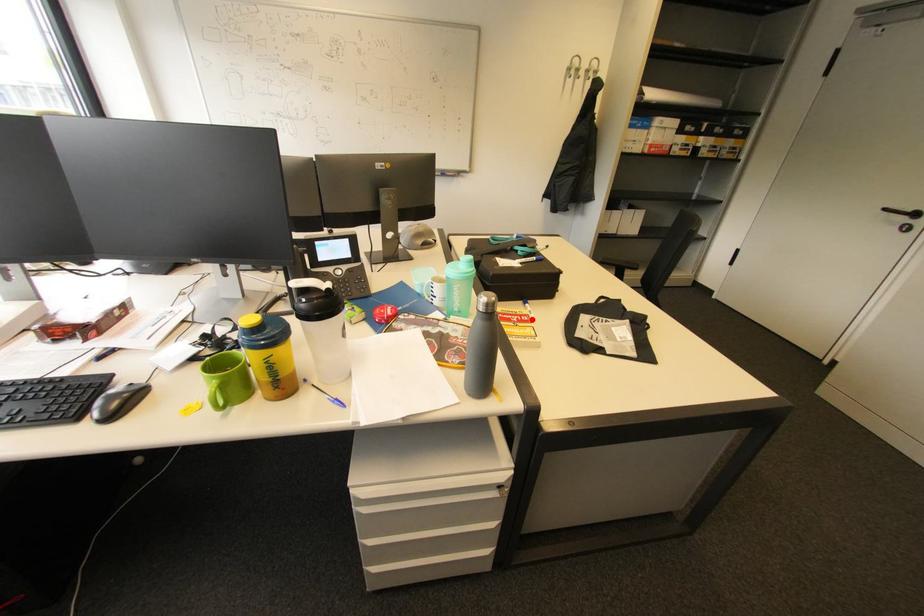
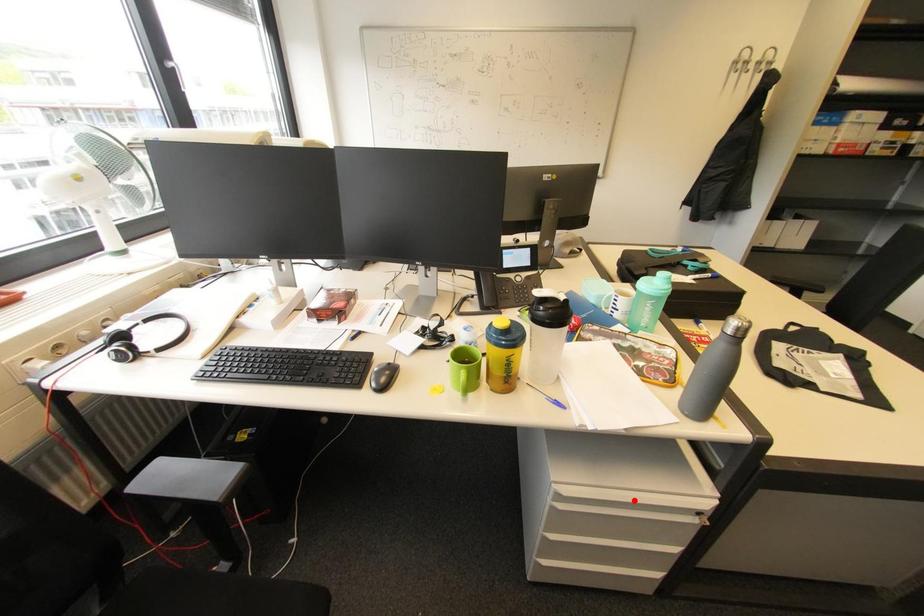
I am providing you with two images of the same scene from different viewpoints. A red point is marked on the first image and another point is marked on the second image. Is the marked point in image1 the same physical position as the marked point in image2?

No